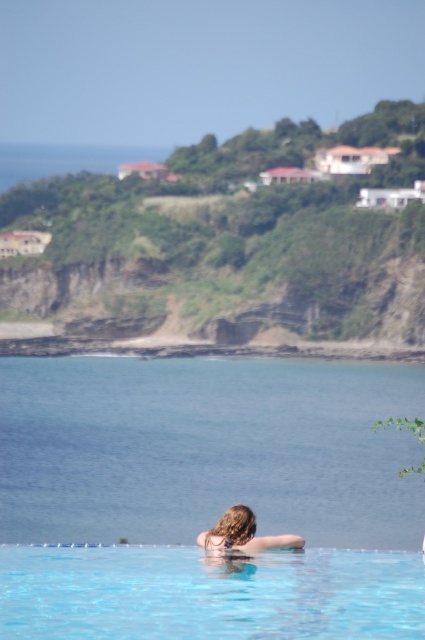
Question: Which point is closer to the camera taking this photo?

Choices:
 (A) (107, 428)
 (B) (244, 531)

Answer: (B)

Question: Observing the image, what is the correct spatial positioning of transparent blue water at center in reference to blonde hair at upper center?

Choices:
 (A) right
 (B) left

Answer: (B)

Question: Considering the real-world distances, which object is farthest from the blonde hair at upper center?

Choices:
 (A) clear glass pool at center
 (B) transparent blue water at center

Answer: (B)

Question: Does transparent blue water at center appear under blonde hair at upper center?

Choices:
 (A) no
 (B) yes

Answer: (A)

Question: From the image, what is the correct spatial relationship of clear glass pool at center in relation to blonde hair at upper center?

Choices:
 (A) left
 (B) right

Answer: (A)

Question: Which point is farther to the camera?

Choices:
 (A) clear glass pool at center
 (B) blonde hair at upper center
 (C) transparent blue water at center

Answer: (C)